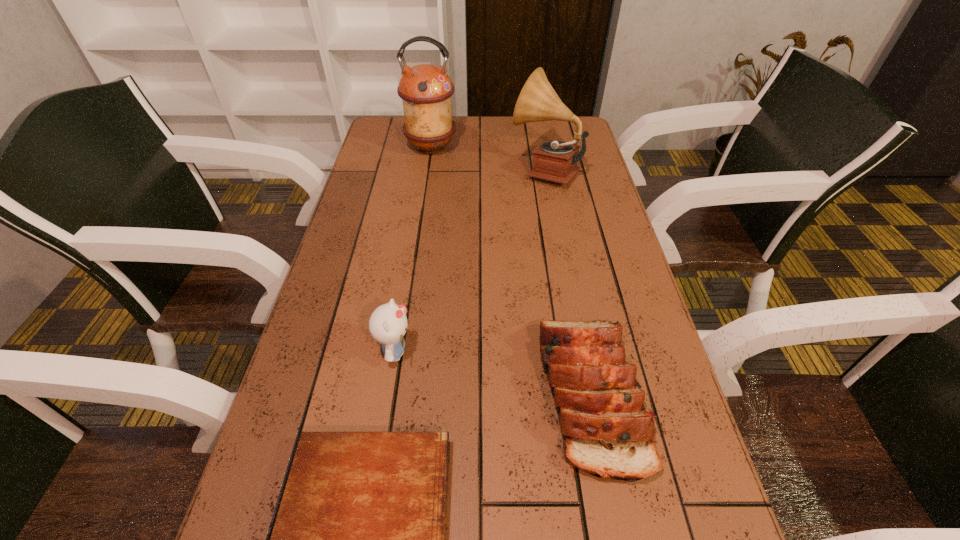
Identify the location of oil lamp. (426, 90).

At what (x,y) coordinates should I click in order to perform the action: click on phonograph record. Please return your answer as a coordinate pair (x, y). Looking at the image, I should click on (556, 161).

Image resolution: width=960 pixels, height=540 pixels. I want to click on the third shortest object, so click(x=388, y=323).

The height and width of the screenshot is (540, 960). Identify the location of bread. (606, 431).

You are a GUI agent. You are given a task and a screenshot of the screen. Output one action in this format:
    pyautogui.click(x=<x>, y=<y>)
    Task: Click on the free point located on the right of the oil lamp
    The width and height of the screenshot is (960, 540).
    Given the screenshot: What is the action you would take?
    pyautogui.click(x=486, y=147)

The width and height of the screenshot is (960, 540). I want to click on free space located 0.280m on the horn of the fourth shortest object, so click(x=421, y=170).

I want to click on vacant region located on the horn of the fourth shortest object, so click(x=431, y=170).

Where is `vacant space located on the horn of the fourth shortest object`? Image resolution: width=960 pixels, height=540 pixels. vacant space located on the horn of the fourth shortest object is located at coordinates pyautogui.click(x=441, y=170).

At what (x,y) coordinates should I click in order to perform the action: click on blank space located 0.260m on the front-facing side of the third shortest object. Please return your answer as a coordinate pair (x, y). Looking at the image, I should click on (538, 352).

At what (x,y) coordinates should I click in order to perform the action: click on vacant point located on the right of the second shortest object. Please return your answer as a coordinate pair (x, y). The height and width of the screenshot is (540, 960). Looking at the image, I should click on (669, 396).